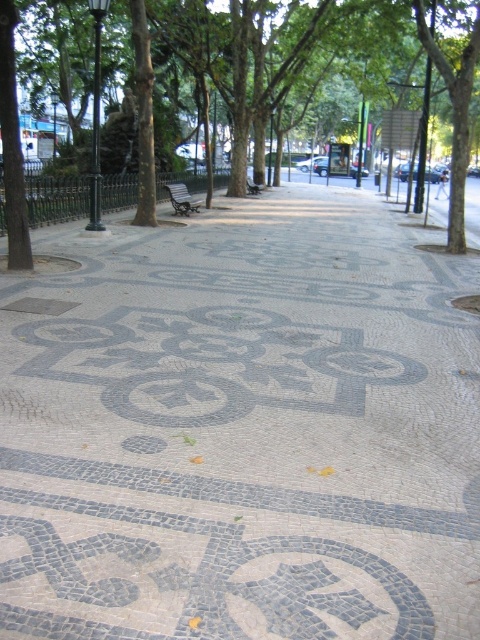
Who is positioned more to the right, gray mosaic pavement at center or wooden park bench at center?

From the viewer's perspective, gray mosaic pavement at center appears more on the right side.

Does gray mosaic pavement at center have a lesser width compared to wooden park bench at center?

No, gray mosaic pavement at center is not thinner than wooden park bench at center.

This screenshot has height=640, width=480. Identify the location of gray mosaic pavement at center. (241, 428).

Find the location of `gray mosaic bicycle at center`. gray mosaic bicycle at center is located at coordinates (212, 364).

Does gray mosaic bicycle at center have a larger size compared to wooden park bench at center?

Yes.

Between point (377, 381) and point (167, 188), which one is positioned behind?

Point (167, 188)

Locate an element on the screen. This screenshot has height=640, width=480. gray mosaic bicycle at center is located at coordinates (212, 364).

Is gray mosaic pavement at center further to the viewer compared to green leafy tree at center?

No, gray mosaic pavement at center is in front of green leafy tree at center.

Based on the photo, can you confirm if gray mosaic pavement at center is bigger than green leafy tree at center?

No, gray mosaic pavement at center is not bigger than green leafy tree at center.

At what (x,y) coordinates should I click in order to perform the action: click on gray mosaic pavement at center. Please return your answer as a coordinate pair (x, y). The height and width of the screenshot is (640, 480). Looking at the image, I should click on (241, 428).

I want to click on gray mosaic pavement at center, so click(x=241, y=428).